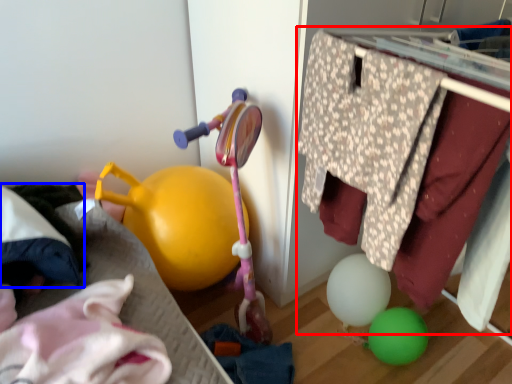
Question: Which point is closer to the camera, closet (highlighted by a red box) or clothing (highlighted by a blue box)?

Choices:
 (A) closet
 (B) clothing

Answer: (A)